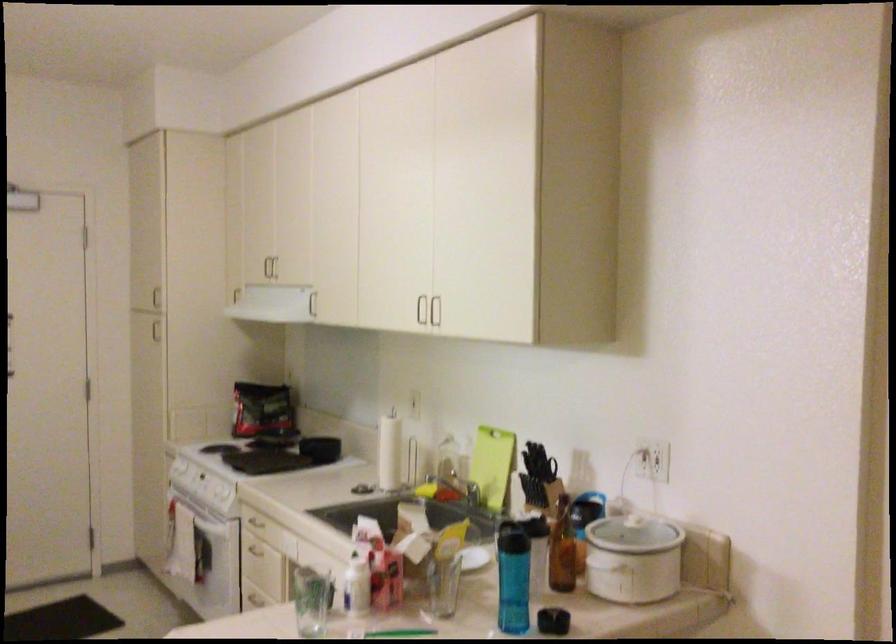
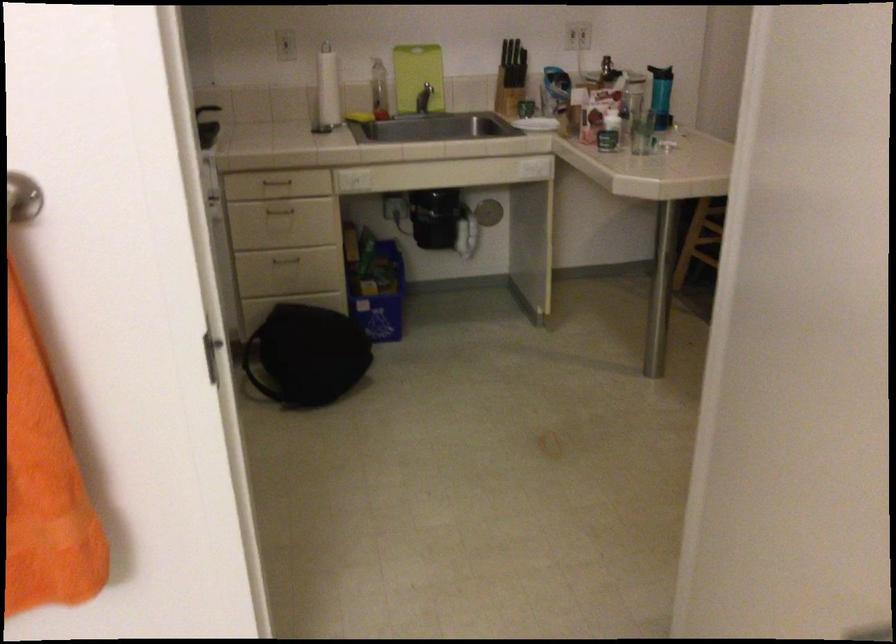
Find the pixel in the second image that matches (x=263, y=550) in the first image.

(279, 210)